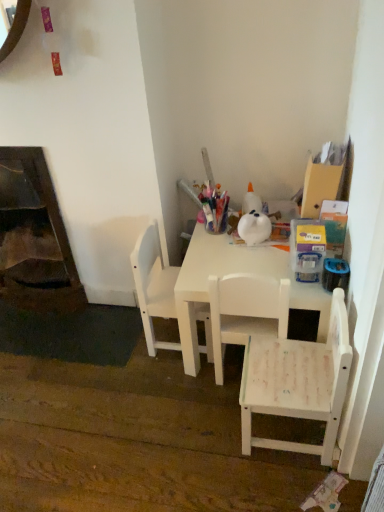
Where is `white matte chair at lower right, marked as the third chair in a left-to-right arrangement`? Image resolution: width=384 pixels, height=512 pixels. white matte chair at lower right, marked as the third chair in a left-to-right arrangement is located at coordinates (298, 383).

The image size is (384, 512). Describe the element at coordinates (153, 286) in the screenshot. I see `white matte chair at center, positioned as the 1th chair in left-to-right order` at that location.

You are a GUI agent. You are given a task and a screenshot of the screen. Output one action in this format:
    pyautogui.click(x=<x>, y=<y>)
    Task: Click on the white matte chair at center, acting as the 3th chair starting from the right
    This screenshot has height=512, width=384.
    Given the screenshot: What is the action you would take?
    pyautogui.click(x=153, y=286)

Find the location of a particular element. This screenshot has width=384, height=512. white matte chair at lower right, the 1th chair viewed from the right is located at coordinates (298, 383).

Is white matte table at center at the back of white matte chair at lower right, marked as the third chair in a left-to-right arrangement?

No, white matte chair at lower right, marked as the third chair in a left-to-right arrangement,'s orientation is not away from white matte table at center.

Can you confirm if white matte chair at lower right, marked as the third chair in a left-to-right arrangement, is positioned to the right of white matte table at center?

Yes.

Does point (301, 374) come closer to viewer compared to point (176, 291)?

Yes, it is.

Between white matte chair at lower right, the 1th chair viewed from the right, and white matte table at center, which one has larger width?

With larger width is white matte table at center.

From a real-world perspective, is white matte chair at center, positioned as the 1th chair in left-to-right order, physically above white matte chair at lower right, the 1th chair viewed from the right?

Indeed, from a real-world perspective, white matte chair at center, positioned as the 1th chair in left-to-right order, stands above white matte chair at lower right, the 1th chair viewed from the right.

Which of these two, white matte chair at center, acting as the 3th chair starting from the right, or white matte chair at lower right, the 1th chair viewed from the right, is bigger?

white matte chair at lower right, the 1th chair viewed from the right, is bigger.

At what (x,y) coordinates should I click in order to perform the action: click on the 2nd chair positioned above the white matte chair at lower right, the 1th chair viewed from the right (from a real-world perspective). Please return your answer as a coordinate pair (x, y). This screenshot has height=512, width=384. Looking at the image, I should click on (153, 286).

Considering the relative sizes of white matte chair at center, acting as the second chair starting from the right, and white matte table at center in the image provided, is white matte chair at center, acting as the second chair starting from the right, thinner than white matte table at center?

Indeed, white matte chair at center, acting as the second chair starting from the right, has a lesser width compared to white matte table at center.

Identify the location of table that is above the white matte chair at center, the 2th chair when ordered from left to right (from the image's perspective). The image size is (384, 512). (232, 274).

Does white matte chair at center, acting as the second chair starting from the right, have a greater height compared to white matte table at center?

Correct, white matte chair at center, acting as the second chair starting from the right, is much taller as white matte table at center.

Is white matte chair at lower right, marked as the third chair in a left-to-right arrangement, wider than dark brown wood fireplace at lower left?

Yes, white matte chair at lower right, marked as the third chair in a left-to-right arrangement, is wider than dark brown wood fireplace at lower left.

From a real-world perspective, is white matte chair at lower right, marked as the third chair in a left-to-right arrangement, positioned above or below dark brown wood fireplace at lower left?

white matte chair at lower right, marked as the third chair in a left-to-right arrangement, is below dark brown wood fireplace at lower left.

This screenshot has width=384, height=512. I want to click on fireplace to the left of white matte chair at lower right, the 1th chair viewed from the right, so click(x=34, y=237).

Between white matte table at center and white matte chair at lower right, marked as the third chair in a left-to-right arrangement, which one is positioned behind?

white matte table at center is more distant.

Does white matte table at center have a lesser width compared to white matte chair at lower right, marked as the third chair in a left-to-right arrangement?

In fact, white matte table at center might be wider than white matte chair at lower right, marked as the third chair in a left-to-right arrangement.

Could you tell me if white matte table at center is facing white matte chair at lower right, the 1th chair viewed from the right?

No, white matte table at center does not turn towards white matte chair at lower right, the 1th chair viewed from the right.

From the image's perspective, is white matte table at center above or below white matte chair at lower right, marked as the third chair in a left-to-right arrangement?

From the image's perspective, white matte table at center appears above white matte chair at lower right, marked as the third chair in a left-to-right arrangement.

From a real-world perspective, is dark brown wood fireplace at lower left above or below white matte chair at center, acting as the 3th chair starting from the right?

From a real-world perspective, dark brown wood fireplace at lower left is physically above white matte chair at center, acting as the 3th chair starting from the right.

Is dark brown wood fireplace at lower left situated inside white matte chair at center, acting as the 3th chair starting from the right, or outside?

dark brown wood fireplace at lower left is located beyond the bounds of white matte chair at center, acting as the 3th chair starting from the right.

What's the angular difference between dark brown wood fireplace at lower left and white matte chair at center, positioned as the 1th chair in left-to-right order,'s facing directions?

They differ by 88.9 degrees in their facing directions.

Is dark brown wood fireplace at lower left shorter than white matte chair at center, acting as the 3th chair starting from the right?

No, dark brown wood fireplace at lower left is not shorter than white matte chair at center, acting as the 3th chair starting from the right.

Is dark brown wood fireplace at lower left surrounding white matte table at center?

No, white matte table at center is located outside of dark brown wood fireplace at lower left.

Considering the sizes of objects dark brown wood fireplace at lower left and white matte table at center in the image provided, who is thinner, dark brown wood fireplace at lower left or white matte table at center?

With smaller width is dark brown wood fireplace at lower left.

Is there a large distance between dark brown wood fireplace at lower left and white matte table at center?

Actually, dark brown wood fireplace at lower left and white matte table at center are a little close together.

This screenshot has width=384, height=512. I want to click on fireplace above the white matte table at center (from the image's perspective), so click(x=34, y=237).

Where is `the 3rd chair below the white matte table at center (from the image's perspective)`? This screenshot has height=512, width=384. the 3rd chair below the white matte table at center (from the image's perspective) is located at coordinates (298, 383).

At what (x,y) coordinates should I click in order to perform the action: click on the 2nd chair counting from the left of the white matte chair at lower right, marked as the third chair in a left-to-right arrangement. Please return your answer as a coordinate pair (x, y). Looking at the image, I should click on (153, 286).

Which object lies nearer to the anchor point white matte chair at center, acting as the second chair starting from the right, dark brown wood fireplace at lower left or white matte chair at center, positioned as the 1th chair in left-to-right order?

white matte chair at center, positioned as the 1th chair in left-to-right order.

Based on their spatial positions, is white matte chair at lower right, marked as the third chair in a left-to-right arrangement, or dark brown wood fireplace at lower left closer to white matte chair at center, acting as the 3th chair starting from the right?

white matte chair at lower right, marked as the third chair in a left-to-right arrangement, is closer to white matte chair at center, acting as the 3th chair starting from the right.

Based on the photo, from the image, which object appears to be farther from white matte table at center, dark brown wood fireplace at lower left or white matte chair at center, positioned as the 1th chair in left-to-right order?

dark brown wood fireplace at lower left is further to white matte table at center.

Which object lies nearer to the anchor point dark brown wood fireplace at lower left, white matte table at center or white matte chair at center, acting as the 3th chair starting from the right?

white matte chair at center, acting as the 3th chair starting from the right.

From the image, which object appears to be nearer to white matte chair at center, acting as the 3th chair starting from the right, white matte chair at center, acting as the second chair starting from the right, or white matte chair at lower right, marked as the third chair in a left-to-right arrangement?

Among the two, white matte chair at center, acting as the second chair starting from the right, is located nearer to white matte chair at center, acting as the 3th chair starting from the right.

Estimate the real-world distances between objects in this image. Which object is closer to white matte chair at lower right, the 1th chair viewed from the right, dark brown wood fireplace at lower left or white matte chair at center, positioned as the 1th chair in left-to-right order?

Based on the image, white matte chair at center, positioned as the 1th chair in left-to-right order, appears to be nearer to white matte chair at lower right, the 1th chair viewed from the right.

Estimate the real-world distances between objects in this image. Which object is closer to white matte table at center, white matte chair at center, the 2th chair when ordered from left to right, or dark brown wood fireplace at lower left?

Based on the image, white matte chair at center, the 2th chair when ordered from left to right, appears to be nearer to white matte table at center.

Based on their spatial positions, is white matte chair at center, the 2th chair when ordered from left to right, or dark brown wood fireplace at lower left further from white matte chair at lower right, the 1th chair viewed from the right?

Based on the image, dark brown wood fireplace at lower left appears to be further to white matte chair at lower right, the 1th chair viewed from the right.

At what (x,y) coordinates should I click in order to perform the action: click on chair positioned between white matte chair at lower right, the 1th chair viewed from the right, and white matte chair at center, positioned as the 1th chair in left-to-right order, from near to far. Please return your answer as a coordinate pair (x, y). Looking at the image, I should click on (246, 311).

Locate an element on the screen. chair located between white matte chair at center, positioned as the 1th chair in left-to-right order, and white matte table at center in the left-right direction is located at coordinates (246, 311).

The image size is (384, 512). I want to click on chair between dark brown wood fireplace at lower left and white matte chair at center, the 2th chair when ordered from left to right, in the horizontal direction, so click(x=153, y=286).

Locate an element on the screen. The image size is (384, 512). chair between white matte chair at lower right, the 1th chair viewed from the right, and white matte table at center, along the z-axis is located at coordinates (246, 311).